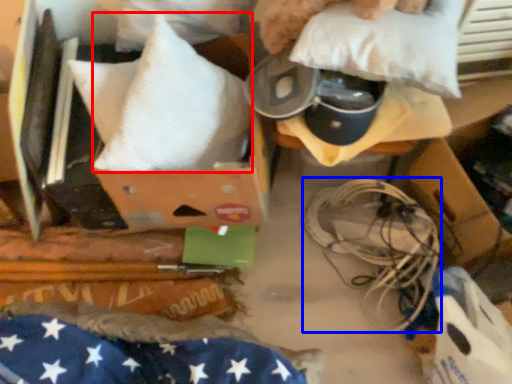
Question: Which object is further to the camera taking this photo, pillow (highlighted by a red box) or wire (highlighted by a blue box)?

Choices:
 (A) pillow
 (B) wire

Answer: (B)